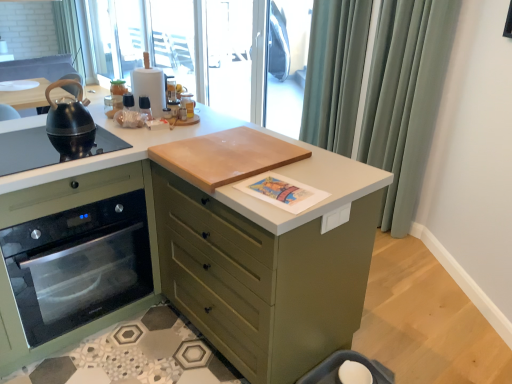
Question: Based on their sizes in the image, would you say transparent plastic window screen at upper center, the 2th window screen in the front-to-back sequence, is bigger or smaller than satin green oven at left?

Choices:
 (A) small
 (B) big

Answer: (A)

Question: Choose the correct answer: Is transparent plastic window screen at upper center, the 1th window screen viewed from the back, inside satin green oven at left or outside it?

Choices:
 (A) outside
 (B) inside

Answer: (A)

Question: Which of these objects is positioned farthest from the white matte countertop at center?

Choices:
 (A) transparent plastic screen door at upper center, which ranks as the 2th screen door in left-to-right order
 (B) transparent glass window at upper center, the 2th window screen in the back-to-front sequence
 (C) black matte gas stove at left
 (D) satin fabric curtain at upper right
 (E) satin green oven at left

Answer: (B)

Question: Which object is the closest to the white matte countertop at center?

Choices:
 (A) black matte gas stove at left
 (B) transparent plastic screen door at upper center, positioned as the 1th screen door in right-to-left order
 (C) satin green oven at left
 (D) transparent glass window at upper center, the 2th window screen in the back-to-front sequence
 (E) satin fabric curtain at upper right

Answer: (C)